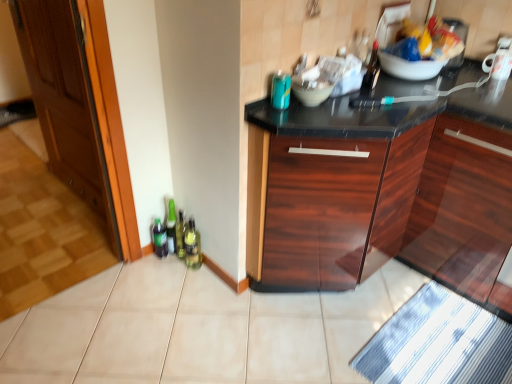
You are a GUI agent. You are given a task and a screenshot of the screen. Output one action in this format:
    pyautogui.click(x=<x>, y=<y>)
    Task: Click on the vacant space to the left of green glass bottle at lower left
    
    Given the screenshot: What is the action you would take?
    pyautogui.click(x=156, y=273)